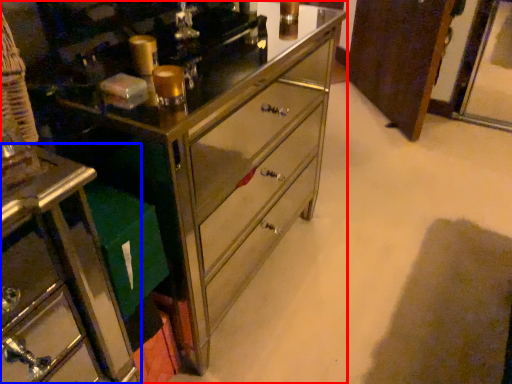
Question: Which object is further to the camera taking this photo, chest of drawers (highlighted by a red box) or furniture (highlighted by a blue box)?

Choices:
 (A) chest of drawers
 (B) furniture

Answer: (B)